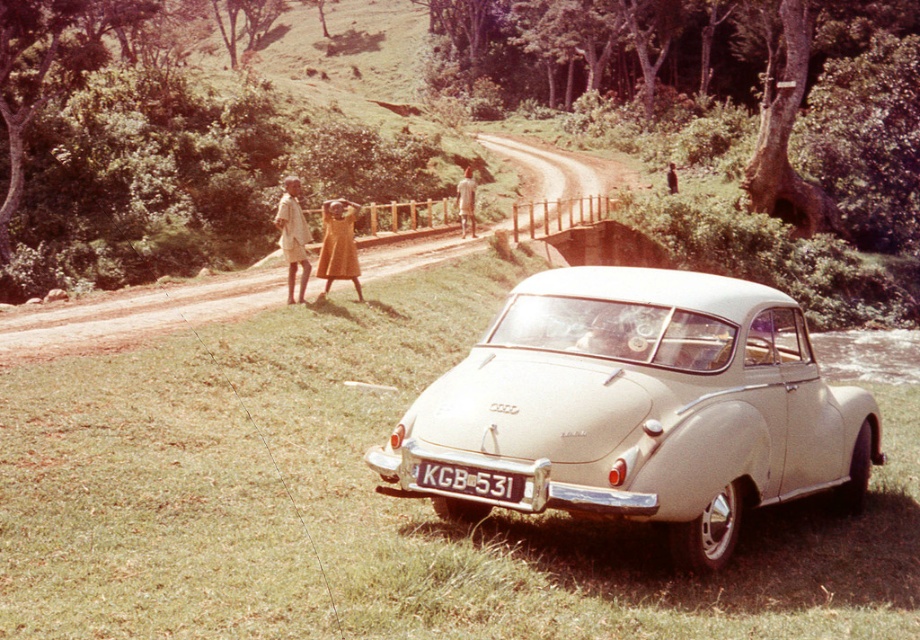
You are standing at the point labeled point (x=641, y=406) in the image. What object is directly in front of you?

The beige matte car at center is directly in front of you at point (x=641, y=406).

You are a photographer taking a picture of the golden fabric dress at center and the white plastic license plate at center. Which object is closer to the camera?

The golden fabric dress at center is closer to the camera because the white plastic license plate at center is positioned under it.